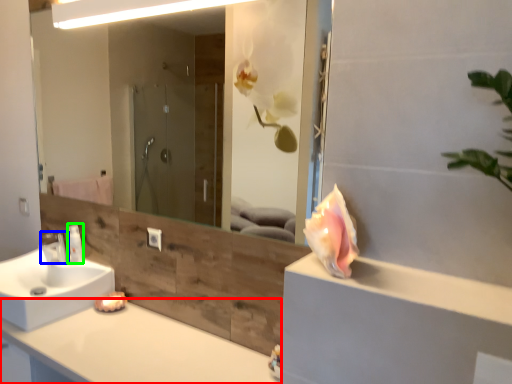
Question: Which object is the closest to the countertop (highlighted by a red box)? Choose among these: tap (highlighted by a blue box) or toiletry (highlighted by a green box).

Choices:
 (A) tap
 (B) toiletry

Answer: (B)